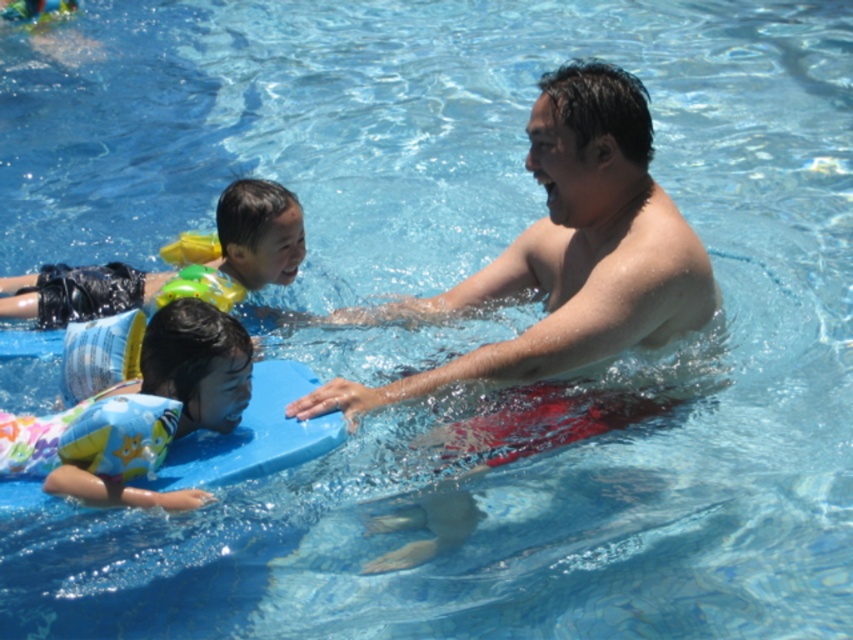
Question: Does shiny skin man at center have a smaller size compared to multicolored inflatable float at lower left?

Choices:
 (A) no
 (B) yes

Answer: (A)

Question: Can you confirm if multicolored inflatable float at lower left is positioned above yellow inflatable float at upper center?

Choices:
 (A) yes
 (B) no

Answer: (B)

Question: Among these points, which one is farthest from the camera?

Choices:
 (A) (505, 369)
 (B) (49, 436)
 (C) (282, 204)

Answer: (C)

Question: Estimate the real-world distances between objects in this image. Which object is closer to the multicolored inflatable float at lower left?

Choices:
 (A) yellow inflatable float at upper center
 (B) shiny skin man at center

Answer: (B)

Question: Which of these objects is positioned closest to the multicolored inflatable float at lower left?

Choices:
 (A) shiny skin man at center
 (B) yellow inflatable float at upper center

Answer: (A)

Question: Can you confirm if shiny skin man at center is positioned to the right of multicolored inflatable float at lower left?

Choices:
 (A) no
 (B) yes

Answer: (B)